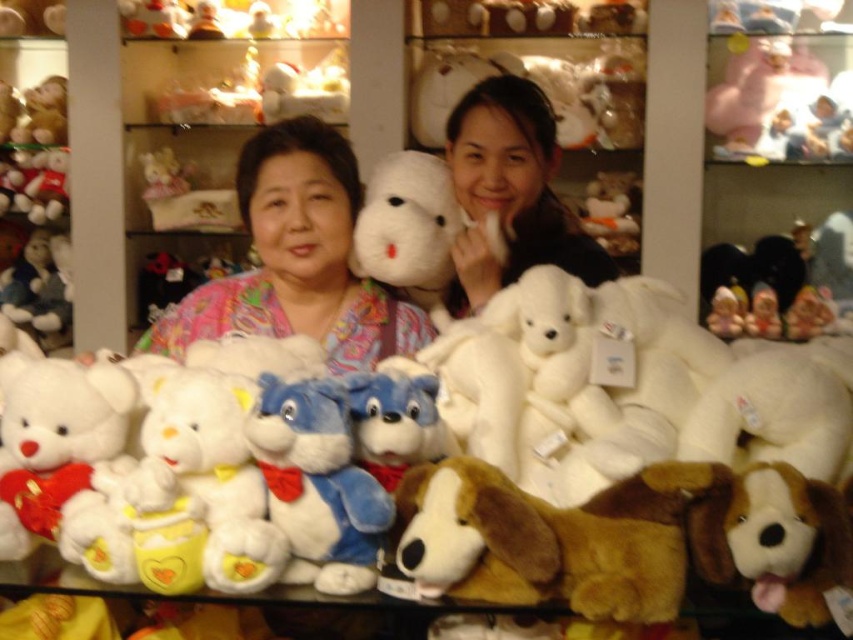
Question: Can you confirm if fluffy white teddy bear at upper left is bigger than white plush bear at upper center?

Choices:
 (A) yes
 (B) no

Answer: (A)

Question: Among these points, which one is nearest to the camera?

Choices:
 (A) (541, 244)
 (B) (425, 360)

Answer: (B)

Question: Which of the following is the farthest from the observer?

Choices:
 (A) (554, 227)
 (B) (213, 314)
 (C) (213, 8)
 (D) (788, 458)

Answer: (C)

Question: Which object is farther from the camera taking this photo?

Choices:
 (A) white plush teddy bear at center
 (B) white plush bear at upper center
 (C) fluffy white teddy bear at upper left
 (D) matte pink blouse at center

Answer: (C)

Question: Can you confirm if white plush teddy bear at center is positioned to the right of matte white teddy bear at upper center?

Choices:
 (A) no
 (B) yes

Answer: (B)

Question: Is white plush teddy bear at center behind fluffy white teddy bear at upper left?

Choices:
 (A) yes
 (B) no

Answer: (B)